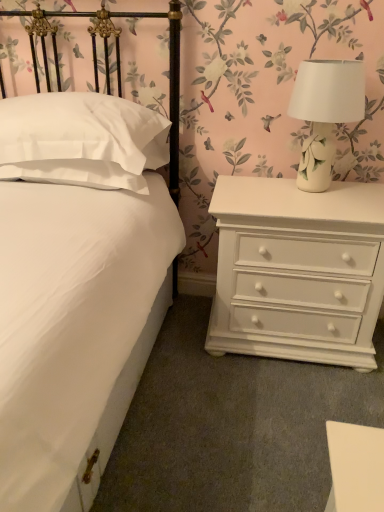
Question: Is point (135, 184) closer or farther from the camera than point (309, 177)?

Choices:
 (A) closer
 (B) farther

Answer: (A)

Question: From the image's perspective, is white matte bed at center located above or below white ceramic lamp at upper right?

Choices:
 (A) above
 (B) below

Answer: (B)

Question: Which of these objects is positioned closest to the white satin pillow at left?

Choices:
 (A) white matte bed at center
 (B) white painted wood chest of drawers at right
 (C) white ceramic lamp at upper right

Answer: (A)

Question: Which is farther from the white matte bed at center?

Choices:
 (A) white ceramic lamp at upper right
 (B) white satin pillow at left
 (C) white painted wood chest of drawers at right

Answer: (A)